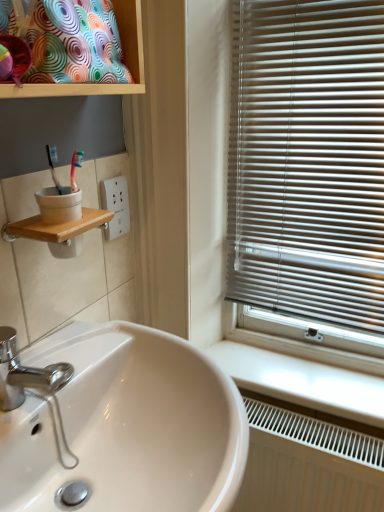
Question: Is point (127, 28) positioned closer to the camera than point (104, 192)?

Choices:
 (A) closer
 (B) farther

Answer: (A)

Question: Looking at the image, does multicolored fabric cushion at upper left seem bigger or smaller compared to white plastic socket at upper center?

Choices:
 (A) small
 (B) big

Answer: (B)

Question: Which object is positioned farthest from the white glossy counter top at lower right?

Choices:
 (A) white plastic socket at upper center
 (B) white glossy sink at lower left
 (C) white textured radiator at lower right
 (D) multicolored fabric cushion at upper left

Answer: (D)

Question: Which is farther from the white plastic socket at upper center?

Choices:
 (A) white glossy sink at lower left
 (B) white textured radiator at lower right
 (C) white glossy counter top at lower right
 (D) multicolored fabric cushion at upper left

Answer: (B)